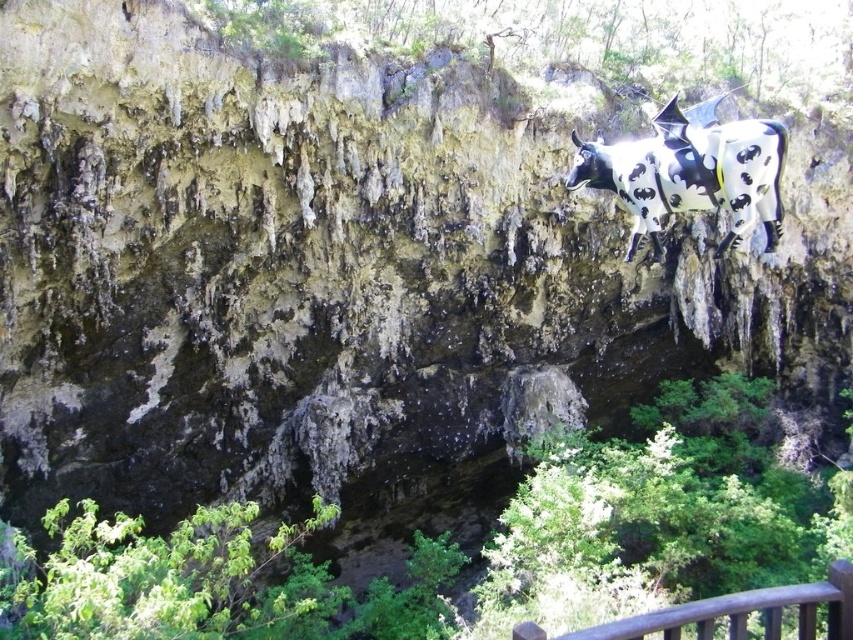
You are a visitor standing at the base of the cliff and see the black and white spotted cow at upper right and the brown wooden rail at lower right. Which object is taller?

The black and white spotted cow at upper right is taller than the brown wooden rail at lower right.

You are a hiker who has just arrived at the cliff edge. You notice the black and white spotted cow at upper right and the brown wooden rail at lower right. Which object is positioned more to the right side of the scene?

The black and white spotted cow at upper right is positioned to the right of the brown wooden rail at lower right, so the cow is more to the right side of the scene.